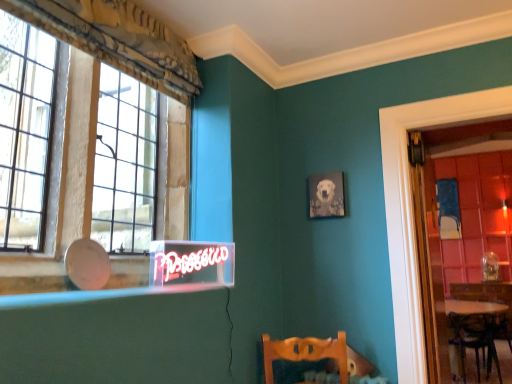
Question: From the image's perspective, is matte gray canvas at upper center under glass paneled window at left?

Choices:
 (A) no
 (B) yes

Answer: (B)

Question: Is matte gray canvas at upper center positioned with its back to glass paneled window at left?

Choices:
 (A) yes
 (B) no

Answer: (B)

Question: Does matte gray canvas at upper center have a lesser width compared to glass paneled window at left?

Choices:
 (A) no
 (B) yes

Answer: (B)

Question: Does matte gray canvas at upper center have a larger size compared to glass paneled window at left?

Choices:
 (A) no
 (B) yes

Answer: (A)

Question: Does matte gray canvas at upper center appear on the left side of glass paneled window at left?

Choices:
 (A) yes
 (B) no

Answer: (B)

Question: Considering the positions of matte gray canvas at upper center and glass paneled window at left in the image, is matte gray canvas at upper center wider or thinner than glass paneled window at left?

Choices:
 (A) wide
 (B) thin

Answer: (B)

Question: Considering the relative positions of matte gray canvas at upper center and glass paneled window at left in the image provided, is matte gray canvas at upper center to the left or to the right of glass paneled window at left?

Choices:
 (A) left
 (B) right

Answer: (B)

Question: Is matte gray canvas at upper center inside or outside of glass paneled window at left?

Choices:
 (A) outside
 (B) inside

Answer: (A)

Question: From the image's perspective, relative to glass paneled window at left, is matte gray canvas at upper center above or below?

Choices:
 (A) above
 (B) below

Answer: (B)

Question: Is clear glass door at right taller or shorter than wooden round table at lower right?

Choices:
 (A) tall
 (B) short

Answer: (A)

Question: Is clear glass door at right wider or thinner than wooden round table at lower right?

Choices:
 (A) thin
 (B) wide

Answer: (A)

Question: From a real-world perspective, is clear glass door at right above or below wooden round table at lower right?

Choices:
 (A) below
 (B) above

Answer: (B)

Question: From the image's perspective, relative to wooden round table at lower right, is clear glass door at right above or below?

Choices:
 (A) above
 (B) below

Answer: (A)

Question: Based on their positions, is wooden round table at lower right located to the left or right of matte gray canvas at upper center?

Choices:
 (A) left
 (B) right

Answer: (B)

Question: In terms of width, does wooden round table at lower right look wider or thinner when compared to matte gray canvas at upper center?

Choices:
 (A) wide
 (B) thin

Answer: (A)